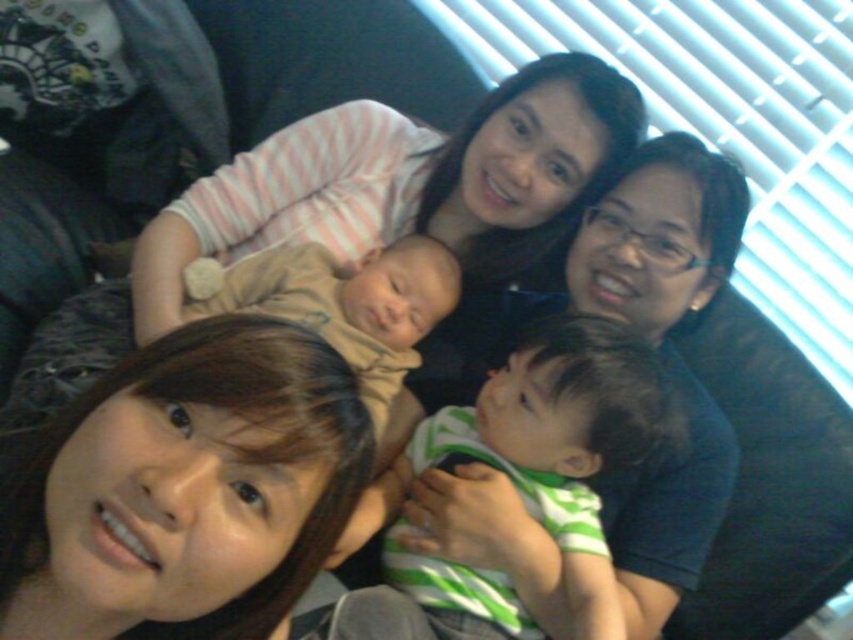
Based on the photo, you are standing in the living room and want to place a small plant between the two points, point [428,566] and point [244,269]. Which point should the plant be closer to if you want it to be nearer to the foreground person?

The plant should be placed closer to point [428,566] because it is closer to the viewer than point [244,269].

Looking at this image, you are a photographer adjusting the lighting in the room. You notice the green striped shirt at center and the soft beige fabric baby at center. Which object is closer to the camera?

The green striped shirt at center is in front of the soft beige fabric baby at center, so it is closer to the camera.